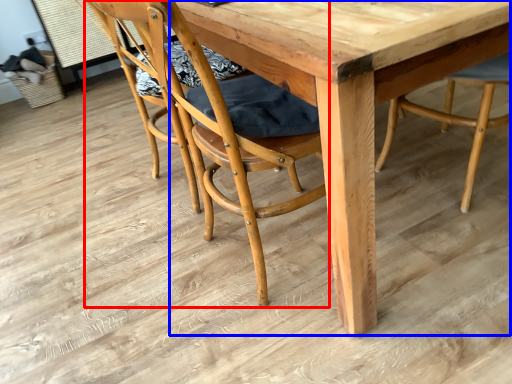
Question: Among these objects, which one is nearest to the camera, chair (highlighted by a red box) or round table (highlighted by a blue box)?

Choices:
 (A) chair
 (B) round table

Answer: (B)